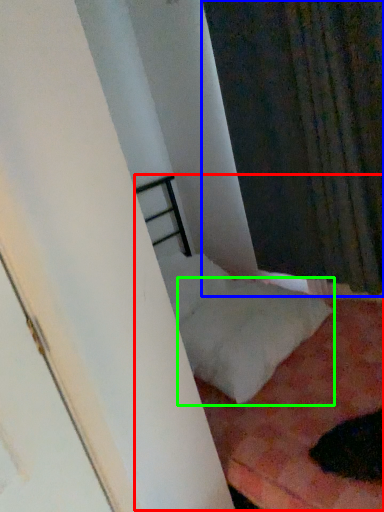
Question: Which is farther away from bed (highlighted by a red box)? curtain (highlighted by a blue box) or pillow (highlighted by a green box)?

Choices:
 (A) curtain
 (B) pillow

Answer: (B)